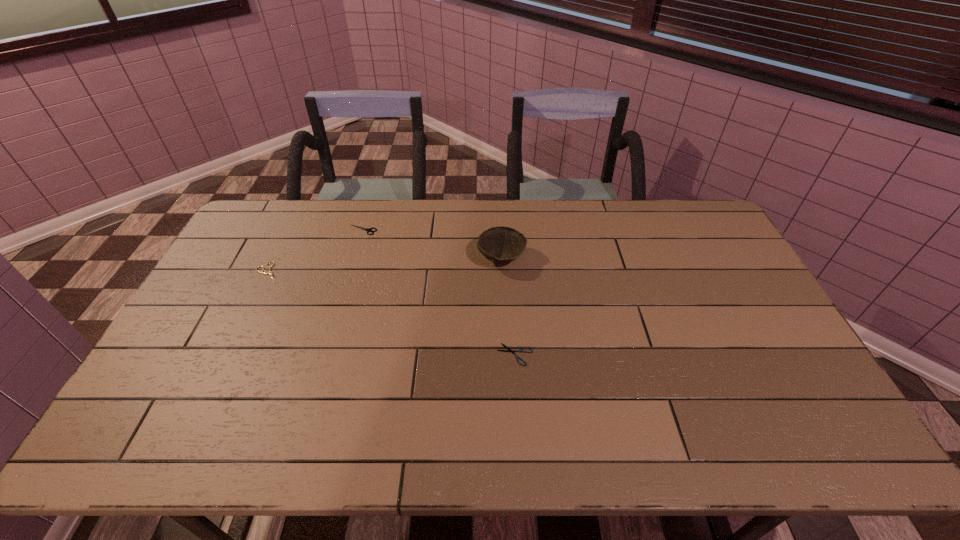
Identify which object is located as the second nearest to the farthest shears. Please provide its 2D coordinates. Your answer should be formatted as a tuple, i.e. [(x, y)], where the tuple contains the x and y coordinates of a point satisfying the conditions above.

[(501, 245)]

Point out which shears is positioned as the nearest to the second tallest shears. Please provide its 2D coordinates. Your answer should be formatted as a tuple, i.e. [(x, y)], where the tuple contains the x and y coordinates of a point satisfying the conditions above.

[(366, 229)]

Identify which shears is located as the second nearest to the shortest object. Please provide its 2D coordinates. Your answer should be formatted as a tuple, i.e. [(x, y)], where the tuple contains the x and y coordinates of a point satisfying the conditions above.

[(270, 272)]

Locate an element on the screen. Image resolution: width=960 pixels, height=540 pixels. free space that satisfies the following two spatial constraints: 1. on the front side of the nearest shears; 2. on the left side of the tallest shears is located at coordinates (325, 354).

Locate an element on the screen. The image size is (960, 540). vacant region that satisfies the following two spatial constraints: 1. on the front side of the farthest shears; 2. on the right side of the nearest object is located at coordinates (325, 354).